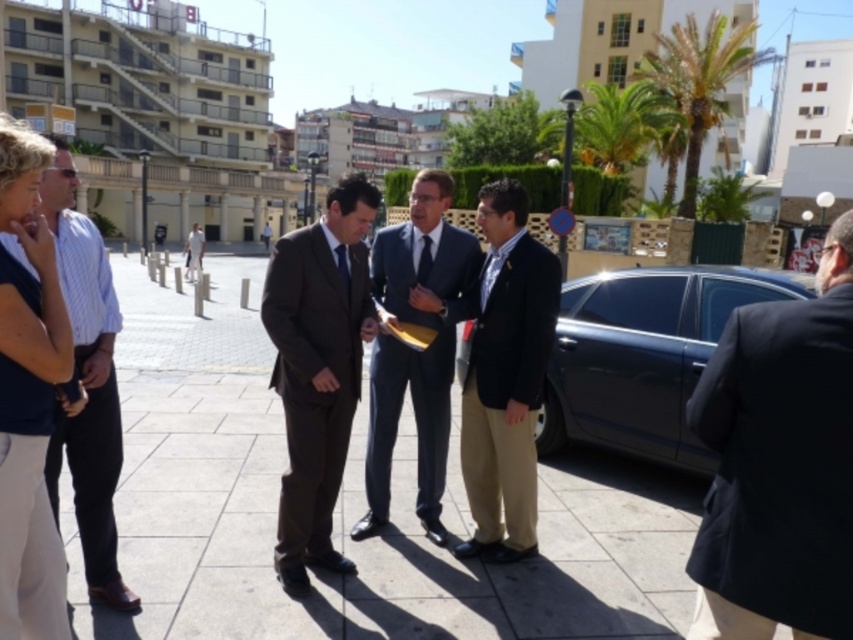
Consider the image. Does dark blue fabric shirt at left lie in front of light blue striped fabric business suit at left?

Yes, it is in front of light blue striped fabric business suit at left.

Who is more distant from viewer, (19, 554) or (90, 232)?

The point (90, 232) is more distant.

Where is `dark blue fabric shirt at left`? The width and height of the screenshot is (853, 640). dark blue fabric shirt at left is located at coordinates (28, 396).

Is point (44, 140) positioned behind point (445, 534)?

No, it is not.

Consider the image. Is dark blue fabric shirt at left above dark blue suit at center?

Yes, dark blue fabric shirt at left is above dark blue suit at center.

This screenshot has height=640, width=853. What do you see at coordinates (28, 396) in the screenshot?
I see `dark blue fabric shirt at left` at bounding box center [28, 396].

Identify the location of dark blue fabric shirt at left. (28, 396).

From the picture: Is khaki cotton pants at center closer to the viewer compared to dark blue suit at center?

Yes, khaki cotton pants at center is in front of dark blue suit at center.

Which is more to the left, khaki cotton pants at center or dark blue suit at center?

dark blue suit at center

Who is more forward, (512, 195) or (399, 237)?

Point (512, 195) is more forward.

The image size is (853, 640). I want to click on khaki cotton pants at center, so click(506, 376).